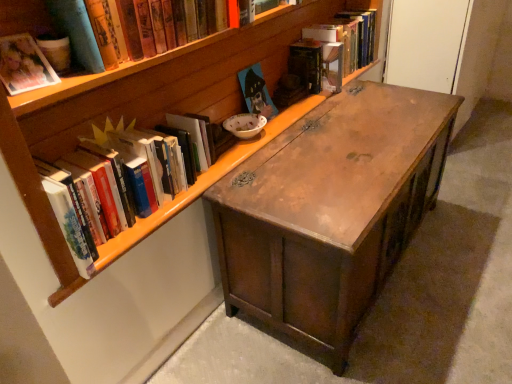
Question: Is hardcover book at upper right, which ranks as the 6th book in front-to-back order, bigger than matte paper photo album at upper left, the second book positioned from the front?

Choices:
 (A) yes
 (B) no

Answer: (A)

Question: Is hardcover book at upper right, which ranks as the first book in back-to-front order, not within matte paper photo album at upper left, the second book positioned from the front?

Choices:
 (A) yes
 (B) no

Answer: (A)

Question: Is hardcover book at upper right, which ranks as the 6th book in front-to-back order, far away from matte paper photo album at upper left, the second book positioned from the front?

Choices:
 (A) no
 (B) yes

Answer: (B)

Question: Is hardcover book at upper right, which ranks as the first book in back-to-front order, at the left side of matte paper photo album at upper left, which is the fifth book from back to front?

Choices:
 (A) no
 (B) yes

Answer: (A)

Question: Does hardcover book at upper right, which ranks as the 6th book in front-to-back order, lie in front of matte paper photo album at upper left, the second book positioned from the front?

Choices:
 (A) yes
 (B) no

Answer: (B)

Question: Can you see hardcover book at upper right, which ranks as the first book in back-to-front order, touching matte paper photo album at upper left, which is the fifth book from back to front?

Choices:
 (A) yes
 (B) no

Answer: (B)

Question: Considering the relative sizes of matte cardboard book at upper left, the first book from the front, and wooden bookcase at upper center in the image provided, is matte cardboard book at upper left, the first book from the front, wider than wooden bookcase at upper center?

Choices:
 (A) no
 (B) yes

Answer: (A)

Question: Does matte cardboard book at upper left, the first book from the front, have a larger size compared to wooden bookcase at upper center?

Choices:
 (A) yes
 (B) no

Answer: (B)

Question: Is matte cardboard book at upper left, the sixth book viewed from the back, at the left side of wooden bookcase at upper center?

Choices:
 (A) yes
 (B) no

Answer: (A)

Question: Is matte cardboard book at upper left, the first book from the front, taller than wooden bookcase at upper center?

Choices:
 (A) no
 (B) yes

Answer: (A)

Question: Is matte cardboard book at upper left, the sixth book viewed from the back, positioned with its back to wooden bookcase at upper center?

Choices:
 (A) no
 (B) yes

Answer: (B)

Question: Is matte cardboard book at upper left, the first book from the front, directly adjacent to wooden bookcase at upper center?

Choices:
 (A) no
 (B) yes

Answer: (A)

Question: Is hardcover book at upper right, which ranks as the first book in back-to-front order, not close to hardcover book at upper center, which is the 5th book from front to back?

Choices:
 (A) no
 (B) yes

Answer: (A)